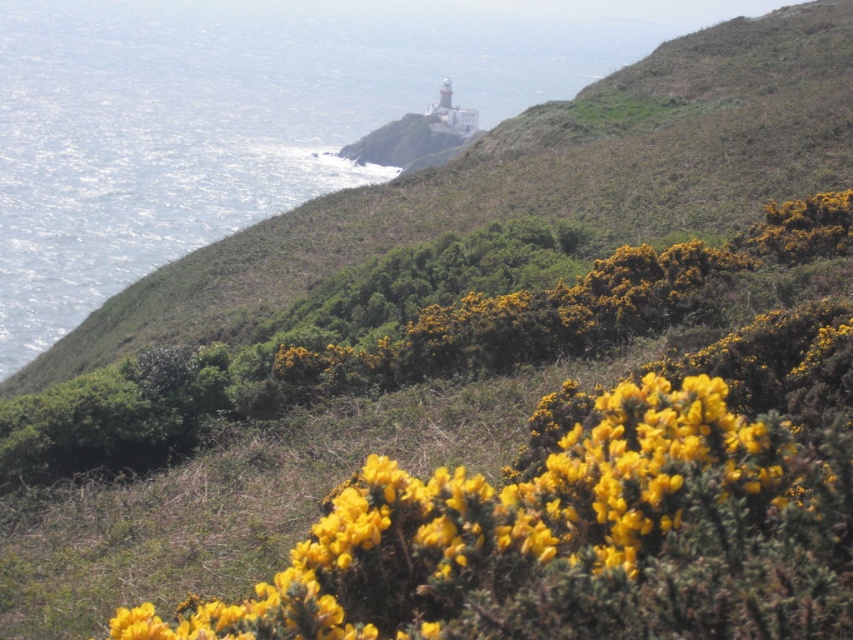
Question: Considering the relative positions of clear blue water at upper left and yellow fuzzy bush at lower center in the image provided, where is clear blue water at upper left located with respect to yellow fuzzy bush at lower center?

Choices:
 (A) left
 (B) right

Answer: (A)

Question: Is clear blue water at upper left in front of yellow fuzzy bush at lower center?

Choices:
 (A) no
 (B) yes

Answer: (A)

Question: Can you confirm if clear blue water at upper left is smaller than yellow fuzzy bush at lower center?

Choices:
 (A) no
 (B) yes

Answer: (A)

Question: Which point appears closest to the camera in this image?

Choices:
 (A) (91, 88)
 (B) (520, 522)

Answer: (B)